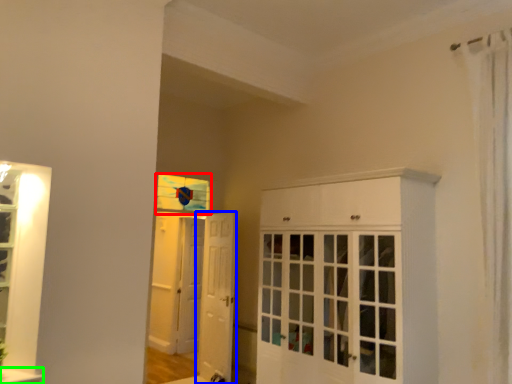
Question: Which object is the farthest from window (highlighted by a red box)? Choose among these: door (highlighted by a blue box) or window sill (highlighted by a green box).

Choices:
 (A) door
 (B) window sill

Answer: (B)